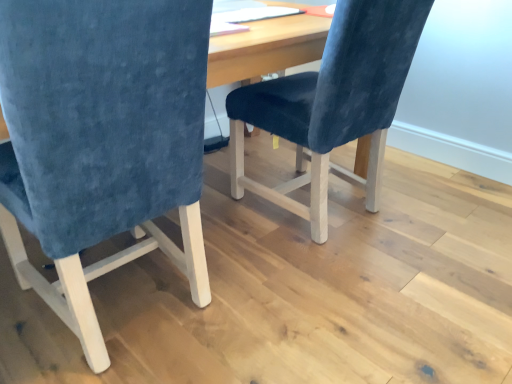
You are a GUI agent. You are given a task and a screenshot of the screen. Output one action in this format:
    pyautogui.click(x=<x>, y=<y>)
    Task: Click on the vacant area that is in front of velvet blue chair at center, which ranks as the first chair in right-to-left order
    This screenshot has height=384, width=512.
    Given the screenshot: What is the action you would take?
    pyautogui.click(x=350, y=294)